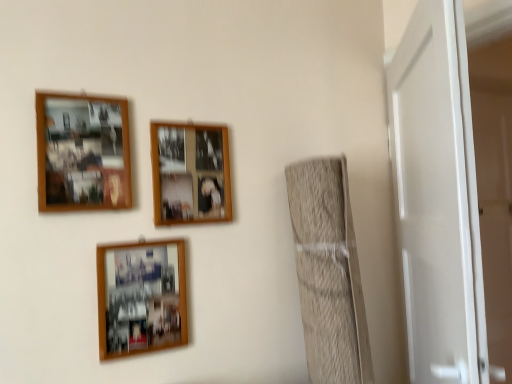
Question: Can you confirm if wooden photo frame at upper left, acting as the 1th picture frame starting from the top, is taller than wooden photo frame at lower center, which appears as the first picture frame when ordered from the bottom?

Choices:
 (A) yes
 (B) no

Answer: (A)

Question: Is wooden photo frame at upper left, positioned as the 3th picture frame in bottom-to-top order, further to the viewer compared to wooden photo frame at lower center, which is the third picture frame in top-to-bottom order?

Choices:
 (A) no
 (B) yes

Answer: (A)

Question: Is wooden photo frame at upper left, positioned as the 3th picture frame in bottom-to-top order, next to wooden photo frame at lower center, which is the third picture frame in top-to-bottom order, and touching it?

Choices:
 (A) yes
 (B) no

Answer: (B)

Question: Is wooden photo frame at upper left, positioned as the 3th picture frame in bottom-to-top order, aimed at wooden photo frame at lower center, which appears as the first picture frame when ordered from the bottom?

Choices:
 (A) no
 (B) yes

Answer: (A)

Question: Is wooden photo frame at upper left, positioned as the 3th picture frame in bottom-to-top order, positioned in front of wooden photo frame at lower center, which is the third picture frame in top-to-bottom order?

Choices:
 (A) no
 (B) yes

Answer: (B)

Question: Visually, is woodenobject at upper center, the 2th picture frame in the bottom-to-top sequence, positioned to the left or to the right of wooden photo frame at upper left, positioned as the 3th picture frame in bottom-to-top order?

Choices:
 (A) right
 (B) left

Answer: (A)

Question: Do you think woodenobject at upper center, arranged as the 2th picture frame when viewed from the top, is within wooden photo frame at upper left, positioned as the 3th picture frame in bottom-to-top order, or outside of it?

Choices:
 (A) outside
 (B) inside

Answer: (A)

Question: From the image's perspective, is woodenobject at upper center, arranged as the 2th picture frame when viewed from the top, located above or below wooden photo frame at upper left, positioned as the 3th picture frame in bottom-to-top order?

Choices:
 (A) above
 (B) below

Answer: (B)

Question: In terms of size, does woodenobject at upper center, the 2th picture frame in the bottom-to-top sequence, appear bigger or smaller than wooden photo frame at upper left, acting as the 1th picture frame starting from the top?

Choices:
 (A) big
 (B) small

Answer: (B)

Question: Considering the positions of wooden photo frame at lower center, which is the third picture frame in top-to-bottom order, and white glossy door at right in the image, is wooden photo frame at lower center, which is the third picture frame in top-to-bottom order, bigger or smaller than white glossy door at right?

Choices:
 (A) big
 (B) small

Answer: (B)

Question: Is wooden photo frame at lower center, which is the third picture frame in top-to-bottom order, spatially inside white glossy door at right, or outside of it?

Choices:
 (A) outside
 (B) inside

Answer: (A)

Question: Looking at their shapes, would you say wooden photo frame at lower center, which appears as the first picture frame when ordered from the bottom, is wider or thinner than white glossy door at right?

Choices:
 (A) wide
 (B) thin

Answer: (B)

Question: Is wooden photo frame at lower center, which is the third picture frame in top-to-bottom order, to the left or to the right of white glossy door at right in the image?

Choices:
 (A) left
 (B) right

Answer: (A)

Question: Based on their positions, is wooden photo frame at upper left, acting as the 1th picture frame starting from the top, located to the left or right of white glossy door at right?

Choices:
 (A) right
 (B) left

Answer: (B)

Question: Is wooden photo frame at upper left, acting as the 1th picture frame starting from the top, wider or thinner than white glossy door at right?

Choices:
 (A) thin
 (B) wide

Answer: (A)